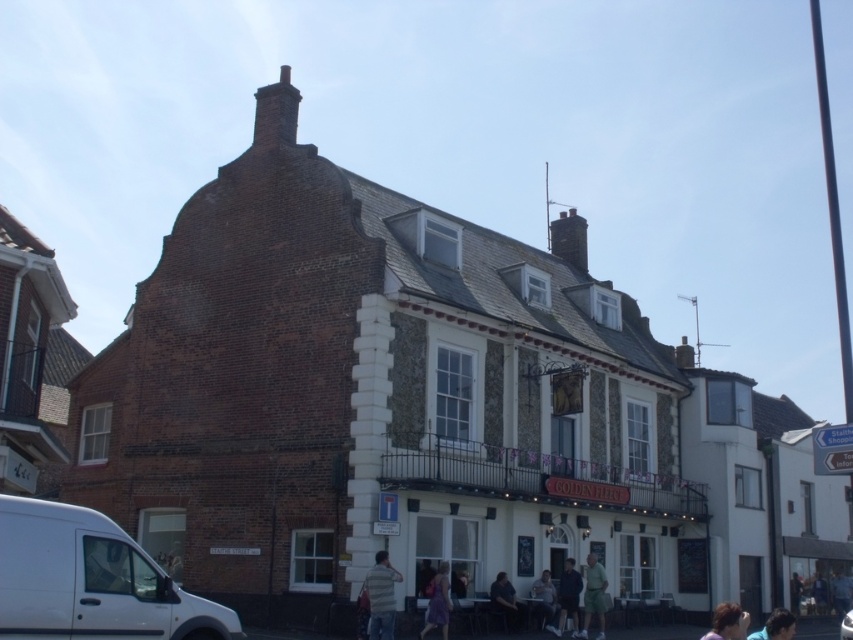
You are standing in front of the Golden Fleece building and want to take a photo. There are two points marked on the building. One is at coordinates point (448,596) and the other is at point (566,618). Which point will appear closer to the center of your camera view when you aim directly at the building?

Point (448,596) is closer to the camera than point (566,618), so it will appear closer to the center of your camera view when aiming directly at the building.

You are standing in front of the traditional building and notice a matte purple dress at lower center. Where exactly is the matte purple dress positioned in relation to the building?

The matte purple dress at lower center is located at the coordinates point (438, 602), which places it near the lower central area of the scene, close to the entrance of the building.

You are a delivery driver who needs to park your white matte van at lower left near the dark brown brick chimney at upper center. Considering their sizes, will your van block the view of the chimney from the street?

The white matte van at lower left is larger in size than the dark brown brick chimney at upper center. Since the van is bigger, it could potentially block the view of the chimney if parked too close, depending on the angle and distance from the street.